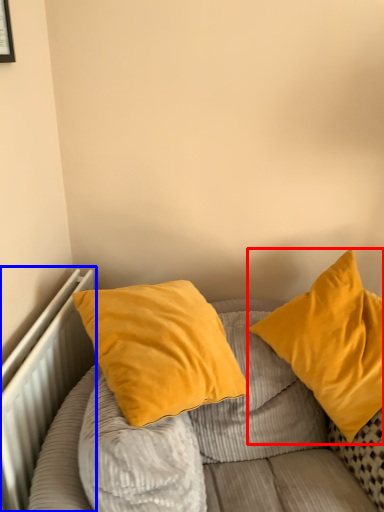
Question: Which point is closer to the camera, pillow (highlighted by a red box) or radiator (highlighted by a blue box)?

Choices:
 (A) pillow
 (B) radiator

Answer: (B)